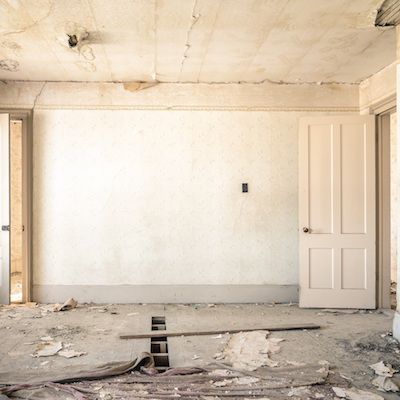
Where is `outlet`? This screenshot has height=400, width=400. outlet is located at coordinates (244, 190).